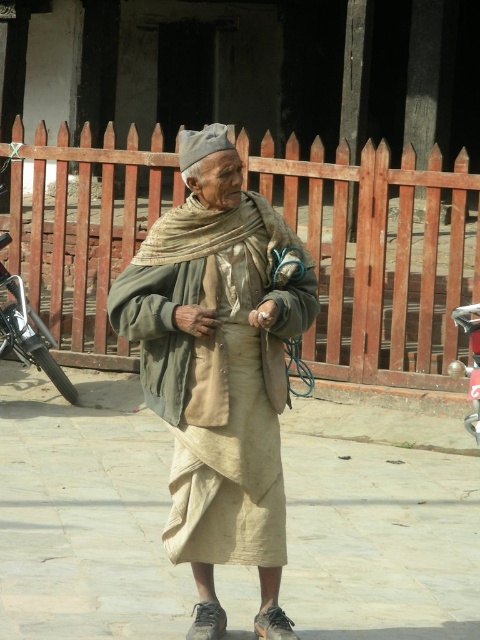
How far apart are the beige fabric skirt at center and the grayish cap?

The beige fabric skirt at center and the grayish cap are 4.29 meters apart.

You are a fashion designer observing the elderly individual in the courtyard. You notice the beige fabric skirt at center and the beige fabric shawl at center. Which of these two items is located to the left when viewed from the front?

The beige fabric skirt at center is positioned on the left side of the beige fabric shawl at center, so when viewed from the front, the beige fabric skirt at center is to the left of the beige fabric shawl at center.